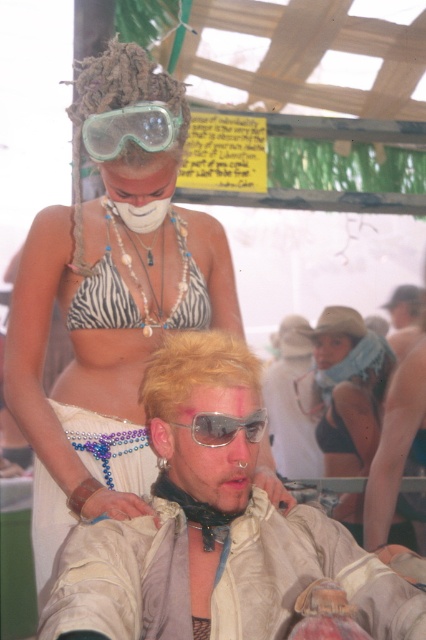
Question: Is transparent plastic goggles at upper center to the right of white matte mask at center from the viewer's perspective?

Choices:
 (A) no
 (B) yes

Answer: (B)

Question: Is zebra print bikini top at upper left thinner than matte khaki jacket at center?

Choices:
 (A) yes
 (B) no

Answer: (A)

Question: Which object appears farthest from the camera in this image?

Choices:
 (A) transparent plastic goggles at center
 (B) white matte mask at center

Answer: (B)

Question: Can you confirm if white matte mask at center is smaller than transparent plastic goggles at center?

Choices:
 (A) yes
 (B) no

Answer: (B)

Question: Estimate the real-world distances between objects in this image. Which object is farther from the black matte bikini top at upper center?

Choices:
 (A) white matte mask at center
 (B) transparent plastic goggles at center

Answer: (B)

Question: Which point is farther to the camera?

Choices:
 (A) white matte mask at center
 (B) blondehair at center

Answer: (A)